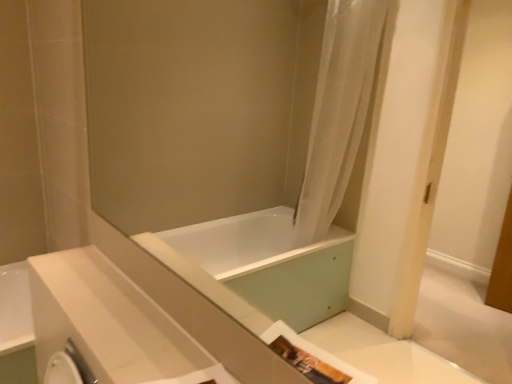
Locate an element on the screen. This screenshot has height=384, width=512. vacant region above white glossy drawer at lower left (from a real-world perspective) is located at coordinates (109, 312).